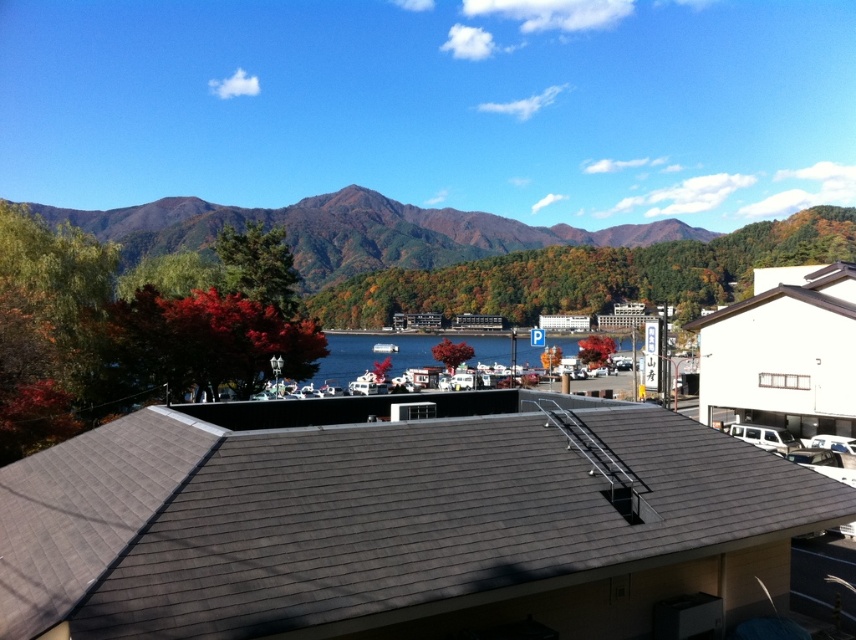
You are standing at the point with coordinates point (372,355) in the image. What is directly below you?

The point (372,355) is on blue water at center, so directly below you is blue water at center.

You are planning to launch the white plastic boat at center into the blue water at center. Based on the scene, will the boat fit entirely within the water area?

The blue water at center is wider than the white plastic boat at center, so the boat will fit entirely within the water area.